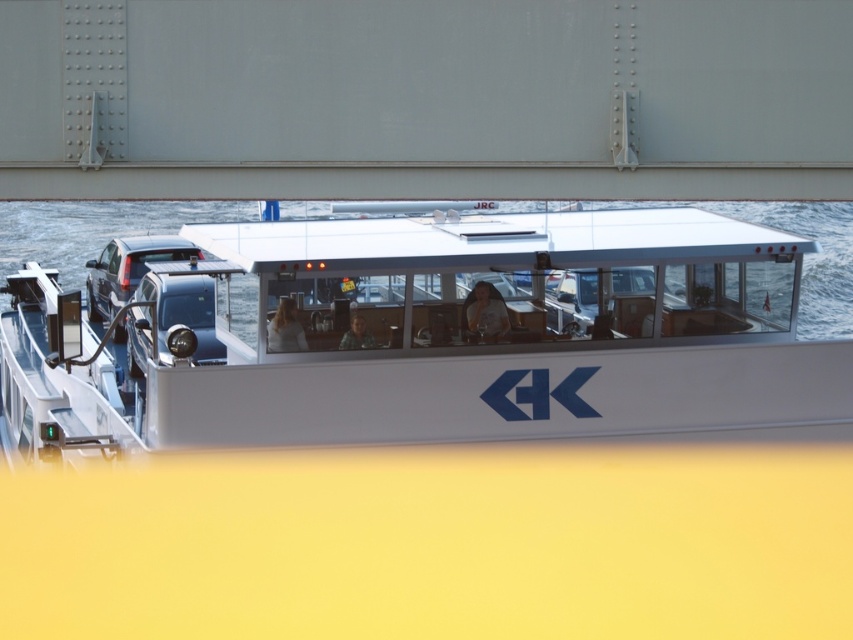
Does white glossy boat at center appear on the left side of smooth skin face at center?

No, white glossy boat at center is not to the left of smooth skin face at center.

Can you confirm if white glossy boat at center is wider than smooth skin face at center?

Yes, white glossy boat at center is wider than smooth skin face at center.

Who is more distant from viewer, (65,472) or (354,336)?

Point (354,336)

Locate an element on the screen. The width and height of the screenshot is (853, 640). white glossy boat at center is located at coordinates (450, 509).

Who is shorter, white glossy boat at center or light brown hair at center?

light brown hair at center is shorter.

Who is lower down, white glossy boat at center or light brown hair at center?

light brown hair at center is lower down.

This screenshot has height=640, width=853. I want to click on white glossy boat at center, so click(450, 509).

Is clear water at center shorter than smooth brown hair at center?

In fact, clear water at center may be taller than smooth brown hair at center.

Which is in front, point (44, 260) or point (496, 298)?

Positioned in front is point (496, 298).

You are a GUI agent. You are given a task and a screenshot of the screen. Output one action in this format:
    pyautogui.click(x=<x>, y=<y>)
    Task: Click on the clear water at center
    
    Given the screenshot: What is the action you would take?
    pyautogui.click(x=93, y=227)

You are a GUI agent. You are given a task and a screenshot of the screen. Output one action in this format:
    pyautogui.click(x=<x>, y=<y>)
    Task: Click on the clear water at center
    This screenshot has height=640, width=853.
    Given the screenshot: What is the action you would take?
    pyautogui.click(x=93, y=227)